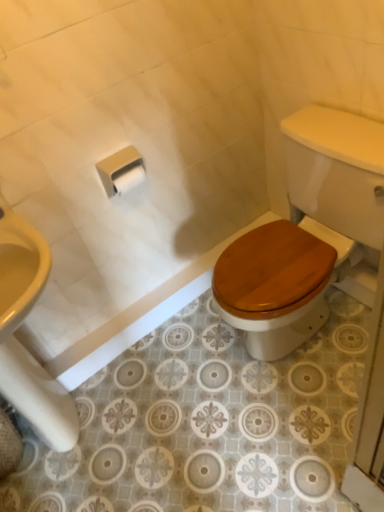
Question: Should I look upward or downward to see white matte toilet paper at center, marked as the 1th toilet paper in a front-to-back arrangement?

Choices:
 (A) down
 (B) up

Answer: (B)

Question: Considering the relative sizes of white matte toilet paper at center, marked as the 1th toilet paper in a front-to-back arrangement, and wooden at lower right in the image provided, is white matte toilet paper at center, marked as the 1th toilet paper in a front-to-back arrangement, wider than wooden at lower right?

Choices:
 (A) no
 (B) yes

Answer: (A)

Question: Considering the relative positions of white matte toilet paper at center, positioned as the second toilet paper in back-to-front order, and wooden at lower right in the image provided, is white matte toilet paper at center, positioned as the second toilet paper in back-to-front order, to the left of wooden at lower right from the viewer's perspective?

Choices:
 (A) yes
 (B) no

Answer: (A)

Question: From the image's perspective, is white matte toilet paper at center, marked as the 1th toilet paper in a front-to-back arrangement, above wooden at lower right?

Choices:
 (A) no
 (B) yes

Answer: (B)

Question: Does white matte toilet paper at center, marked as the 1th toilet paper in a front-to-back arrangement, touch wooden at lower right?

Choices:
 (A) yes
 (B) no

Answer: (B)

Question: Is white matte toilet paper at center, marked as the 1th toilet paper in a front-to-back arrangement, outside wooden at lower right?

Choices:
 (A) no
 (B) yes

Answer: (B)

Question: Can you confirm if white matte toilet paper at center, marked as the 1th toilet paper in a front-to-back arrangement, is bigger than wooden at lower right?

Choices:
 (A) yes
 (B) no

Answer: (B)

Question: Can you confirm if wooden at lower right is thinner than white matte toilet paper at center, marked as the 1th toilet paper in a front-to-back arrangement?

Choices:
 (A) yes
 (B) no

Answer: (B)

Question: Is wooden at lower right facing away from white matte toilet paper at center, positioned as the second toilet paper in back-to-front order?

Choices:
 (A) no
 (B) yes

Answer: (A)

Question: Can you confirm if wooden at lower right is smaller than white matte toilet paper at center, positioned as the second toilet paper in back-to-front order?

Choices:
 (A) yes
 (B) no

Answer: (B)

Question: Considering the relative sizes of wooden at lower right and white matte toilet paper at center, positioned as the second toilet paper in back-to-front order, in the image provided, is wooden at lower right taller than white matte toilet paper at center, positioned as the second toilet paper in back-to-front order,?

Choices:
 (A) yes
 (B) no

Answer: (A)

Question: Is the depth of wooden at lower right greater than that of white matte toilet paper at center, positioned as the second toilet paper in back-to-front order?

Choices:
 (A) yes
 (B) no

Answer: (B)

Question: From the image's perspective, does wooden at lower right appear higher than white matte toilet paper at center, marked as the 1th toilet paper in a front-to-back arrangement?

Choices:
 (A) no
 (B) yes

Answer: (A)

Question: Is white matte toilet paper at upper center, which is counted as the first toilet paper, starting from the back, bigger than wooden at lower right?

Choices:
 (A) yes
 (B) no

Answer: (B)